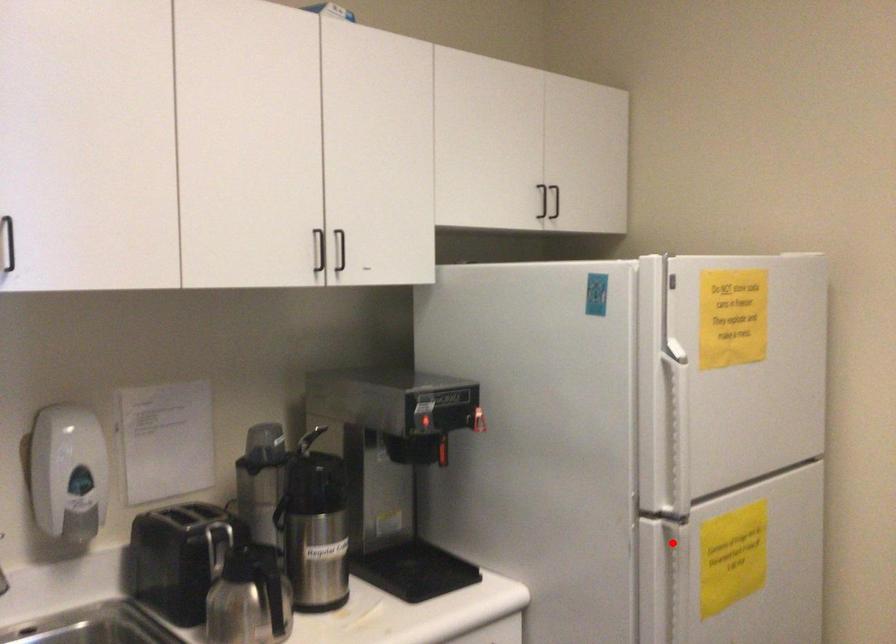
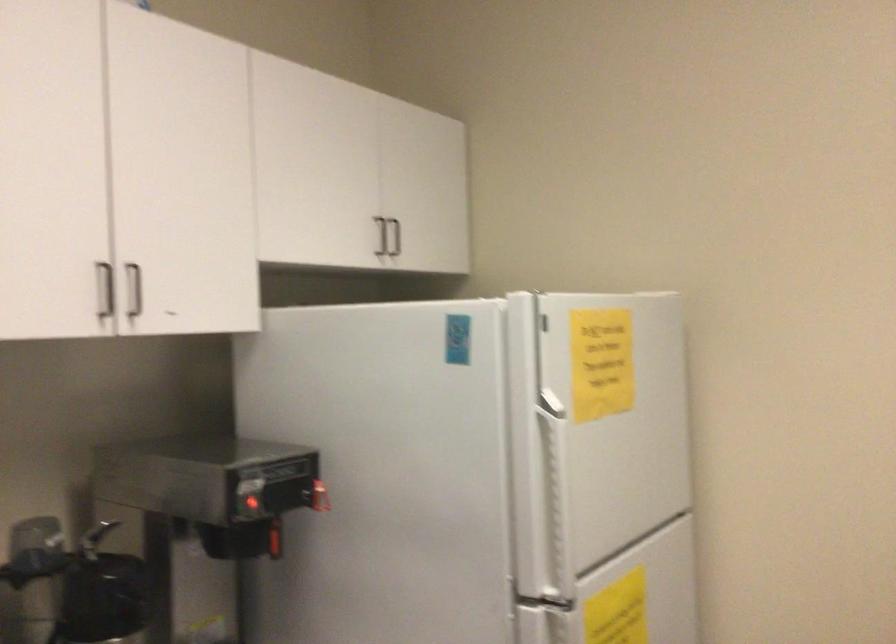
Question: I am providing you with two images of the same scene from different viewpoints. A red point is shown in image1. For the corresponding object point in image2, is it positioned nearer or farther from the camera?

Choices:
 (A) Nearer
 (B) Farther

Answer: (A)